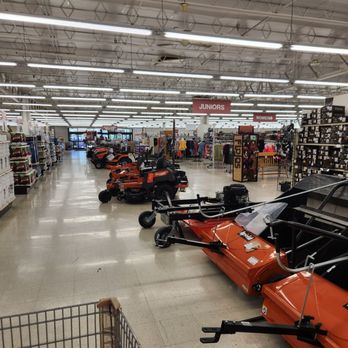
Find the location of a particular element. This screenshot has height=348, width=348. ceiling is located at coordinates (209, 11).